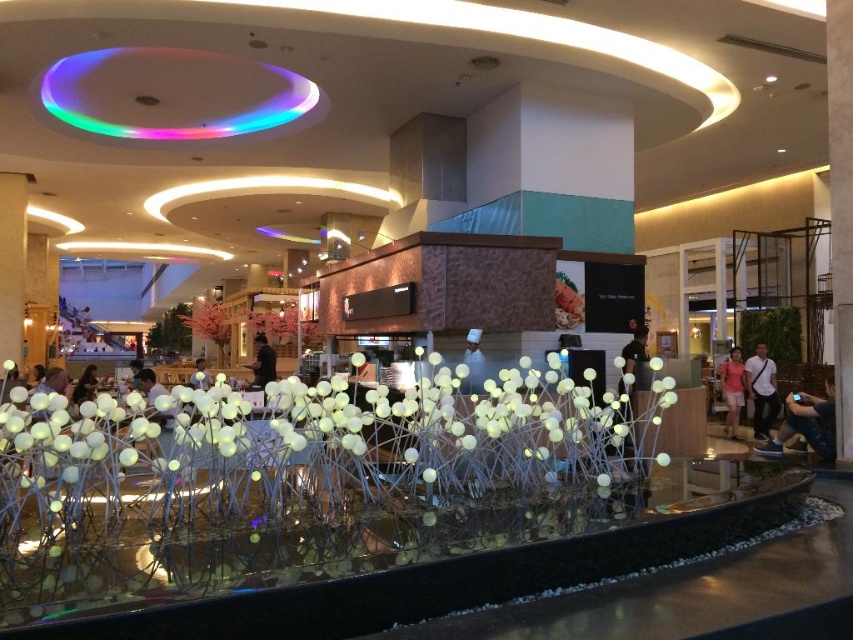
How distant is denim jeans at lower right from black fabric person at center?

They are 21.14 feet apart.

Can you confirm if denim jeans at lower right is positioned to the left of black fabric person at center?

Incorrect, denim jeans at lower right is not on the left side of black fabric person at center.

Is point (801, 394) closer to camera compared to point (254, 381)?

Yes, it is.

Locate an element on the screen. Image resolution: width=853 pixels, height=640 pixels. denim jeans at lower right is located at coordinates (807, 422).

Does matte black shirt at center have a greater width compared to matte black shirt at lower left?

Yes, matte black shirt at center is wider than matte black shirt at lower left.

Does matte black shirt at center appear under matte black shirt at lower left?

No.

Describe the element at coordinates (148, 385) in the screenshot. I see `matte black shirt at center` at that location.

Where is `matte black shirt at center`? matte black shirt at center is located at coordinates (148, 385).

Which of these two, matte black shirt at lower left or dark blue shirt at center, stands taller?

dark blue shirt at center is taller.

Is point (93, 372) closer to camera compared to point (195, 365)?

Yes, it is.

You are a GUI agent. You are given a task and a screenshot of the screen. Output one action in this format:
    pyautogui.click(x=<x>, y=<y>)
    Task: Click on the matte black shirt at lower left
    The image size is (853, 640).
    Given the screenshot: What is the action you would take?
    pyautogui.click(x=84, y=385)